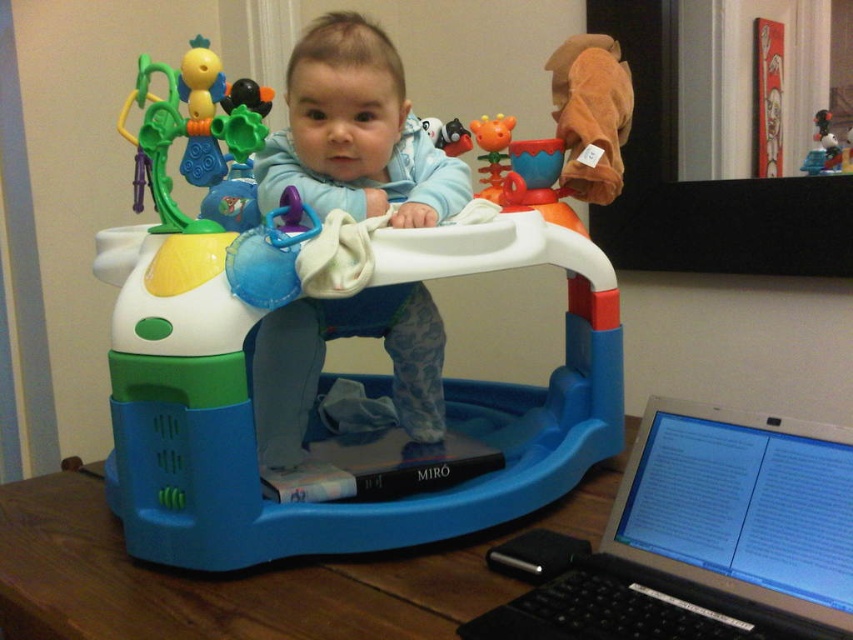
You are a parent trying to place a silver metallic laptop at lower right on the floor next to the blue plastic walker at center. Can you fit both items side by side without overlapping?

The blue plastic walker at center is positioned on the left side of the silver metallic laptop at lower right, so they are already placed side by side without overlapping.

You are a parent trying to place a small toy on the blue plastic walker at center where the point is located. The point is at coordinates (331, 326). Is the point on the blue plastic walker at center?

Yes, the point at coordinates (331, 326) is on the blue plastic walker at center as stated in the objects description.